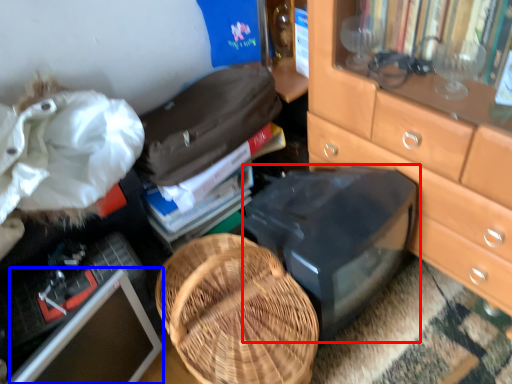
Question: Which of the following is the closest to the observer, desktop (highlighted by a red box) or computer monitor (highlighted by a blue box)?

Choices:
 (A) desktop
 (B) computer monitor

Answer: (B)